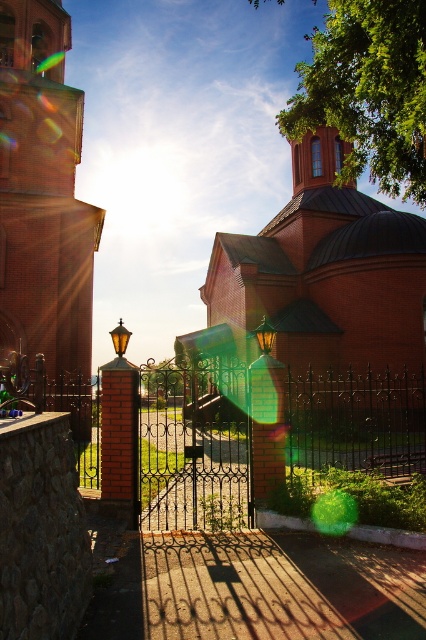
You are a visitor approaching the church and want to take a photo of the brick tower at left through the black wrought iron gate at center. Considering their heights, will the gate obscure the view of the tower?

The black wrought iron gate at center has a lesser height compared to brick tower at left, so the tower will be visible above the gate when taking the photo.

You are standing at the point with coordinates point (345,308), and you want to take a photo of the church. The camera you are using has a focal length of 50mm. To ensure the entire church fits in the frame, you need to be at least 20 meters away. Are you within the required distance?

The point (345,308) and camera are 21.70 meters apart from each other. Since 21.70 meters is more than the required 20 meters, you are within the required distance.